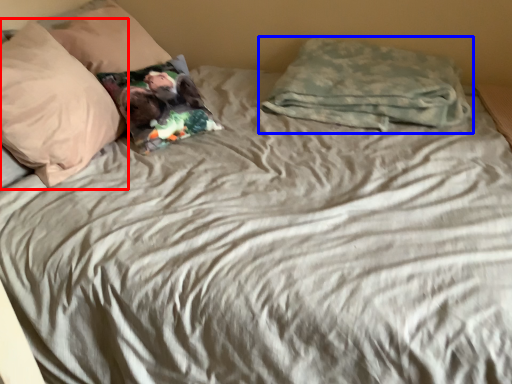
Question: Which of the following is the closest to the observer, pillow (highlighted by a red box) or pillow (highlighted by a blue box)?

Choices:
 (A) pillow
 (B) pillow

Answer: (A)